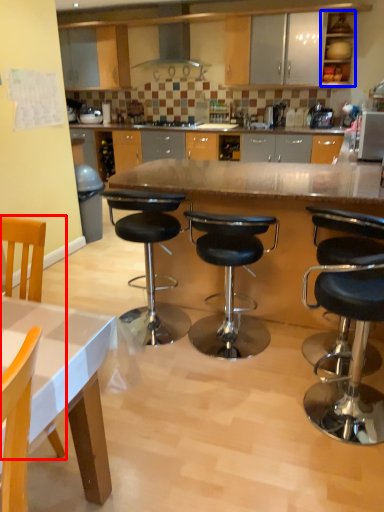
Question: Which of the following is the farthest to the observer, chair (highlighted by a red box) or cabinetry (highlighted by a blue box)?

Choices:
 (A) chair
 (B) cabinetry

Answer: (B)